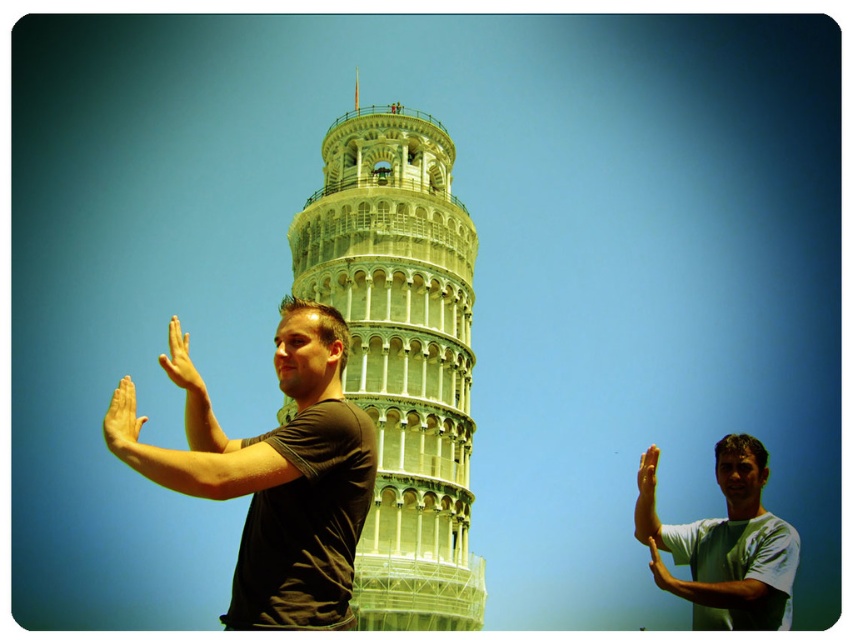
Who is shorter, green matte hand at right or yellow matte hand at center?

With less height is yellow matte hand at center.

Can you confirm if green matte hand at right is thinner than yellow matte hand at center?

Yes, green matte hand at right is thinner than yellow matte hand at center.

Who is more forward, (648, 508) or (177, 369)?

Point (177, 369)

You are a GUI agent. You are given a task and a screenshot of the screen. Output one action in this format:
    pyautogui.click(x=<x>, y=<y>)
    Task: Click on the green matte hand at right
    The image size is (853, 640).
    Given the screenshot: What is the action you would take?
    pyautogui.click(x=646, y=499)

Between smooth skin hand at center and smooth skin hand at right, which one is positioned lower?

smooth skin hand at center

Is smooth skin hand at center further to the viewer compared to smooth skin hand at right?

That is False.

What do you see at coordinates (663, 572) in the screenshot?
I see `smooth skin hand at center` at bounding box center [663, 572].

I want to click on smooth skin hand at center, so click(x=663, y=572).

Can you confirm if yellow matte hand at center is thinner than smooth skin hand at right?

No, yellow matte hand at center is not thinner than smooth skin hand at right.

Is yellow matte hand at center taller than smooth skin hand at right?

No, yellow matte hand at center is not taller than smooth skin hand at right.

Who is more forward, (161, 364) or (647, 460)?

Point (647, 460) is more forward.

The height and width of the screenshot is (640, 853). In order to click on yellow matte hand at center in this screenshot , I will do `click(181, 364)`.